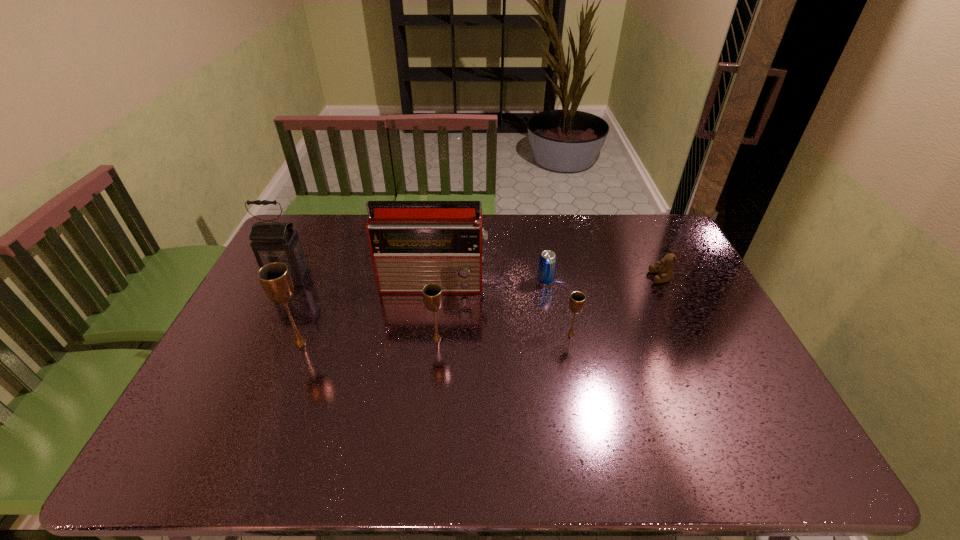
Find the location of a particular element. The height and width of the screenshot is (540, 960). vacant space that satisfies the following two spatial constraints: 1. on the front-facing side of the fifth tallest object; 2. on the left side of the lantern is located at coordinates (261, 335).

At what (x,y) coordinates should I click in order to perform the action: click on vacant point that satisfies the following two spatial constraints: 1. on the front-facing side of the third shortest object; 2. on the left side of the lantern. Please return your answer as a coordinate pair (x, y). This screenshot has width=960, height=540. Looking at the image, I should click on (261, 335).

The width and height of the screenshot is (960, 540). I want to click on free space that satisfies the following two spatial constraints: 1. on the front-facing side of the beer can; 2. on the right side of the leftmost object, so click(x=288, y=281).